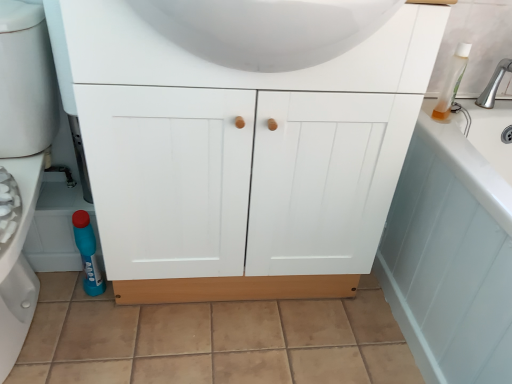
The width and height of the screenshot is (512, 384). I want to click on free spot in front of translucent plastic bottle at upper right, so click(x=448, y=130).